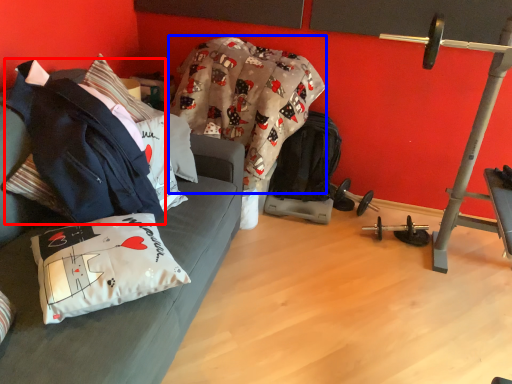
Question: Which of the following is the closest to the observer, jacket (highlighted by a red box) or blanket (highlighted by a blue box)?

Choices:
 (A) jacket
 (B) blanket

Answer: (A)